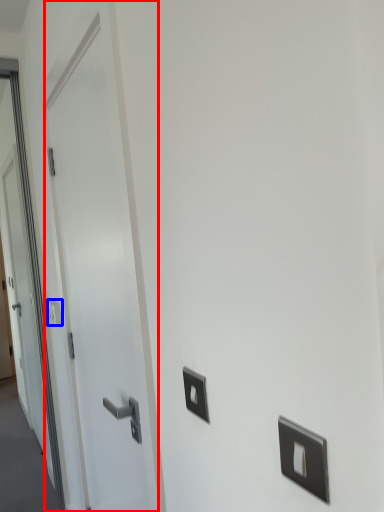
Question: Which point is closer to the camera, door (highlighted by a red box) or light switch (highlighted by a blue box)?

Choices:
 (A) door
 (B) light switch

Answer: (A)